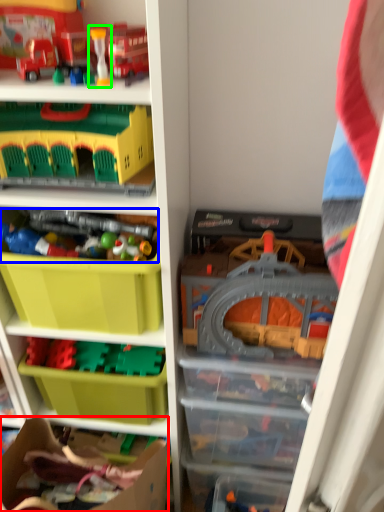
Question: Considering the real-world distances, which object is farthest from cardboard box (highlighted by a red box)? toy (highlighted by a blue box) or toy (highlighted by a green box)?

Choices:
 (A) toy
 (B) toy

Answer: (B)